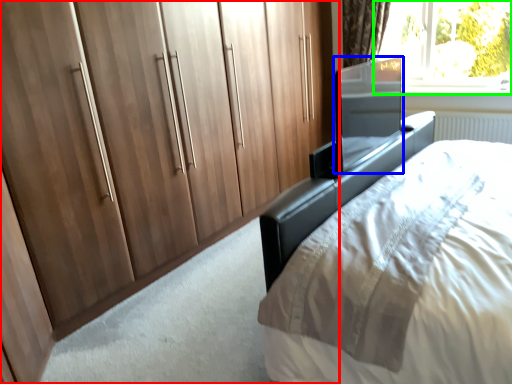
Question: Considering the real-world distances, which object is closest to cupboard (highlighted by a red box)? screen door (highlighted by a blue box) or window (highlighted by a green box).

Choices:
 (A) screen door
 (B) window

Answer: (A)